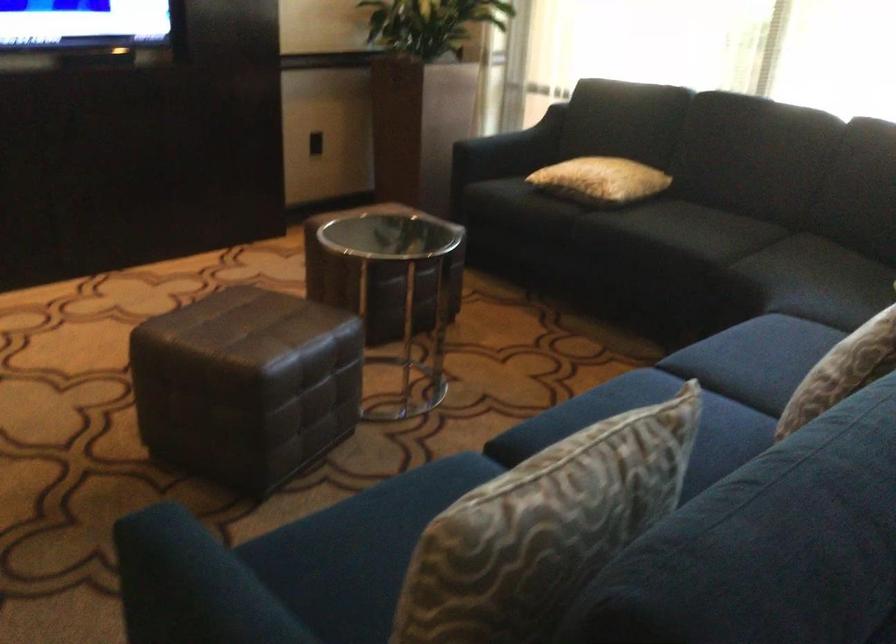
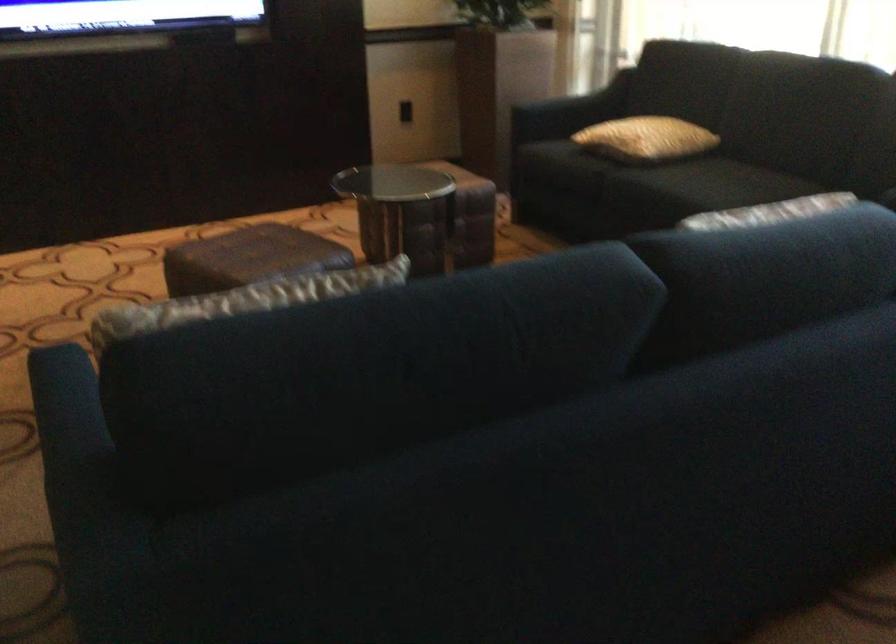
Question: In a continuous first-person perspective shot, in which direction is the camera moving?

Choices:
 (A) Left
 (B) Right
 (C) Forward
 (D) Backward

Answer: (B)